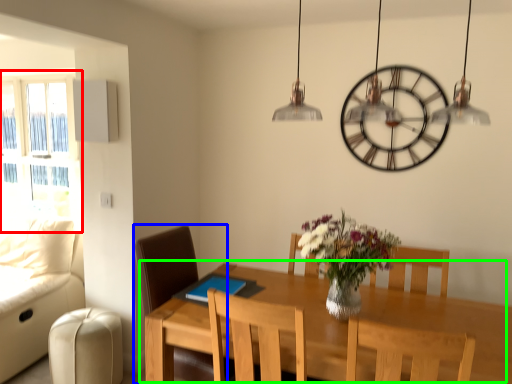
Question: Which object is positioned farthest from window (highlighted by a red box)? Select from chair (highlighted by a blue box) and table (highlighted by a green box).

Choices:
 (A) chair
 (B) table

Answer: (B)